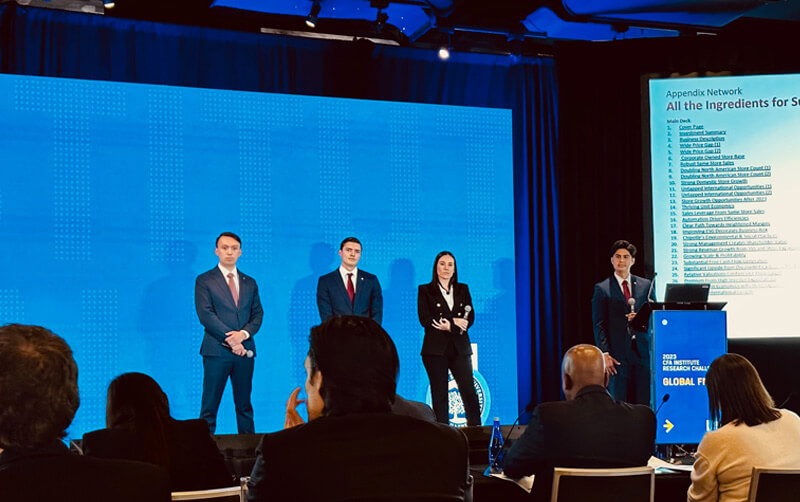
Locate an element on the screen. The width and height of the screenshot is (800, 502). curtain is located at coordinates (538, 259).